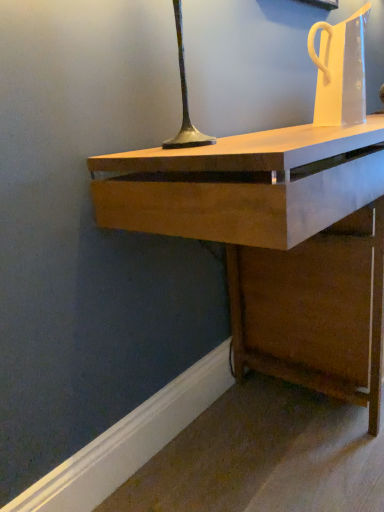
Describe the element at coordinates (340, 71) in the screenshot. I see `transparent plastic jug at upper right` at that location.

Measure the distance between transparent plastic jug at upper right and camera.

The depth of transparent plastic jug at upper right is 1.24 meters.

Locate an element on the screen. transparent plastic jug at upper right is located at coordinates (340, 71).

Image resolution: width=384 pixels, height=512 pixels. Describe the element at coordinates (267, 232) in the screenshot. I see `wooden desk at center` at that location.

What are the coordinates of `wooden desk at center` in the screenshot? It's located at (267, 232).

The image size is (384, 512). I want to click on transparent plastic jug at upper right, so click(x=340, y=71).

Between wooden desk at center and transparent plastic jug at upper right, which one appears on the left side from the viewer's perspective?

From the viewer's perspective, transparent plastic jug at upper right appears more on the left side.

Considering the positions of objects wooden desk at center and transparent plastic jug at upper right in the image provided, who is behind, wooden desk at center or transparent plastic jug at upper right?

transparent plastic jug at upper right is further from the camera.

Does point (219, 150) come farther from viewer compared to point (353, 90)?

No, (219, 150) is closer to viewer.

From the image's perspective, does wooden desk at center appear higher than transparent plastic jug at upper right?

Actually, wooden desk at center appears below transparent plastic jug at upper right in the image.

From a real-world perspective, is wooden desk at center positioned over transparent plastic jug at upper right based on gravity?

No, from a real-world perspective, wooden desk at center is not above transparent plastic jug at upper right.

Which object is thinner, wooden desk at center or transparent plastic jug at upper right?

With smaller width is transparent plastic jug at upper right.

In terms of height, does wooden desk at center look taller or shorter compared to transparent plastic jug at upper right?

In the image, wooden desk at center appears to be taller than transparent plastic jug at upper right.

Can you confirm if wooden desk at center is bigger than transparent plastic jug at upper right?

Yes.

Is wooden desk at center inside the boundaries of transparent plastic jug at upper right, or outside?

wooden desk at center is not enclosed by transparent plastic jug at upper right.

Is wooden desk at center far away from transparent plastic jug at upper right?

No.

Is wooden desk at center oriented towards transparent plastic jug at upper right?

No.

Locate an element on the screen. desk that appears on the right of transparent plastic jug at upper right is located at coordinates (267, 232).

Which object is positioned more to the right, transparent plastic jug at upper right or wooden desk at center?

From the viewer's perspective, wooden desk at center appears more on the right side.

Which is in front, transparent plastic jug at upper right or wooden desk at center?

wooden desk at center is in front.

Considering the points (337, 42) and (361, 128), which point is in front, point (337, 42) or point (361, 128)?

The point (361, 128) is more forward.

From the image's perspective, between transparent plastic jug at upper right and wooden desk at center, which one is located above?

From the image's view, transparent plastic jug at upper right is above.

From a real-world perspective, which object rests below the other?

wooden desk at center.

Considering the sizes of objects transparent plastic jug at upper right and wooden desk at center in the image provided, who is wider, transparent plastic jug at upper right or wooden desk at center?

With larger width is wooden desk at center.

Can you confirm if transparent plastic jug at upper right is taller than wooden desk at center?

In fact, transparent plastic jug at upper right may be shorter than wooden desk at center.

Does transparent plastic jug at upper right have a smaller size compared to wooden desk at center?

Indeed, transparent plastic jug at upper right has a smaller size compared to wooden desk at center.

Is transparent plastic jug at upper right not within wooden desk at center?

Yes.

Is transparent plastic jug at upper right next to wooden desk at center?

No, transparent plastic jug at upper right is not making contact with wooden desk at center.

Could you tell me if transparent plastic jug at upper right is facing wooden desk at center?

No, transparent plastic jug at upper right is not aimed at wooden desk at center.

Can you tell me how much transparent plastic jug at upper right and wooden desk at center differ in facing direction?

There is a 2.11-degree angle between the facing directions of transparent plastic jug at upper right and wooden desk at center.

Locate an element on the screen. The width and height of the screenshot is (384, 512). jug that appears above the wooden desk at center (from a real-world perspective) is located at coordinates (340, 71).

Find the location of a particular element. This screenshot has height=512, width=384. jug behind the wooden desk at center is located at coordinates (340, 71).

I want to click on jug above the wooden desk at center (from a real-world perspective), so click(340, 71).